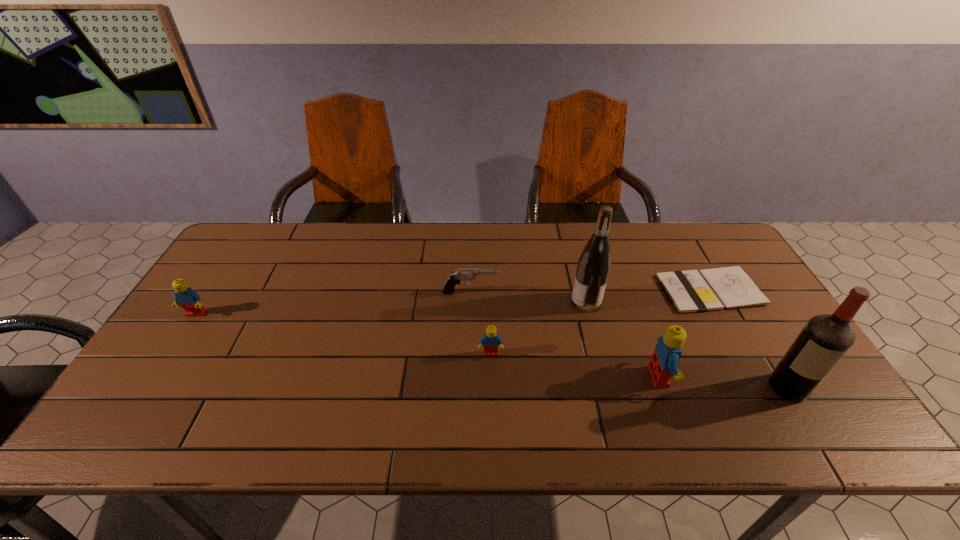
Where is `vacant area that lies between the leftmost Lego and the third tallest object`? This screenshot has width=960, height=540. vacant area that lies between the leftmost Lego and the third tallest object is located at coordinates (427, 346).

You are a GUI agent. You are given a task and a screenshot of the screen. Output one action in this format:
    pyautogui.click(x=<x>, y=<y>)
    Task: Click on the free space that is in between the tallest Lego and the leftmost object
    
    Given the screenshot: What is the action you would take?
    pyautogui.click(x=427, y=346)

Find the location of a particular element. vacant space in between the third object from right to left and the wine bottle is located at coordinates (623, 339).

The height and width of the screenshot is (540, 960). Identify the location of object that can be found as the fourth closest to the gun. (705, 290).

Point out which object is positioned as the second nearest to the gun. Please provide its 2D coordinates. Your answer should be formatted as a tuple, i.e. [(x, y)], where the tuple contains the x and y coordinates of a point satisfying the conditions above.

[(594, 263)]

Identify which Lego is located as the second nearest to the liquor. Please provide its 2D coordinates. Your answer should be formatted as a tuple, i.e. [(x, y)], where the tuple contains the x and y coordinates of a point satisfying the conditions above.

[(491, 340)]

This screenshot has width=960, height=540. In order to click on the second closest Lego to the gun in this screenshot , I will do `click(665, 359)`.

What are the coordinates of `vacant space that satisfies the following two spatial constraints: 1. on the back side of the fourth object from right to left; 2. on the left side of the shortest object` in the screenshot? It's located at (583, 290).